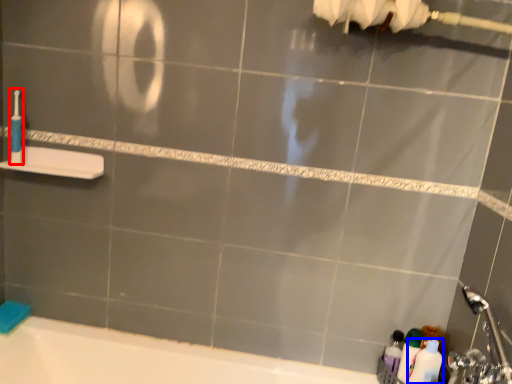
Question: Which of the following is the closest to the observer, toothbrush (highlighted by a red box) or toiletry (highlighted by a blue box)?

Choices:
 (A) toothbrush
 (B) toiletry

Answer: (B)